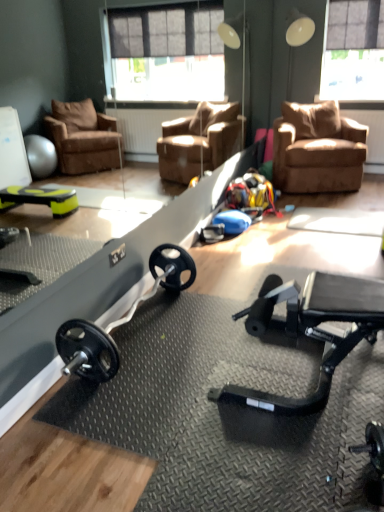
At what (x,y) coordinates should I click in order to perform the action: click on brown suede chair at upper right. Please return your answer as a coordinate pair (x, y). The height and width of the screenshot is (512, 384). Looking at the image, I should click on (317, 149).

This screenshot has height=512, width=384. What do you see at coordinates (353, 51) in the screenshot? I see `translucent plastic window screen at upper right` at bounding box center [353, 51].

The width and height of the screenshot is (384, 512). Identify the location of black rubber barbell at center. (117, 322).

In the image, is black rubber barbell at center positioned in front of or behind brown suede chair at upper right?

In the image, black rubber barbell at center appears in front of brown suede chair at upper right.

Considering the positions of points (107, 362) and (306, 173), is point (107, 362) farther from camera compared to point (306, 173)?

No, it is not.

Considering the sizes of objects black rubber barbell at center and brown suede chair at upper right in the image provided, who is shorter, black rubber barbell at center or brown suede chair at upper right?

black rubber barbell at center.

Is there a large distance between black rubber barbell at center and brown suede chair at upper right?

Indeed, black rubber barbell at center is not near brown suede chair at upper right.

Does brown suede chair at upper right have a lesser width compared to translucent plastic window screen at upper right?

In fact, brown suede chair at upper right might be wider than translucent plastic window screen at upper right.

Is brown suede chair at upper right taller than translucent plastic window screen at upper right?

In fact, brown suede chair at upper right may be shorter than translucent plastic window screen at upper right.

Measure the distance from brown suede chair at upper right to translucent plastic window screen at upper right.

brown suede chair at upper right and translucent plastic window screen at upper right are 1.30 meters apart from each other.

Is brown suede chair at upper right behind black rubber barbell at center?

Yes, brown suede chair at upper right is behind black rubber barbell at center.

Measure the distance between brown suede chair at upper right and black rubber barbell at center.

brown suede chair at upper right and black rubber barbell at center are 8.42 feet apart from each other.

Image resolution: width=384 pixels, height=512 pixels. Find the location of `chair that appears above the black rubber barbell at center (from the image's perspective)`. chair that appears above the black rubber barbell at center (from the image's perspective) is located at coordinates (317, 149).

Can you confirm if brown suede chair at upper right is shorter than black rubber barbell at center?

Incorrect, the height of brown suede chair at upper right does not fall short of that of black rubber barbell at center.

This screenshot has height=512, width=384. Identify the location of window screen that appears behind the brown suede chair at upper right. (353, 51).

How different are the orientations of translucent plastic window screen at upper right and brown suede chair at upper right in degrees?

The facing directions of translucent plastic window screen at upper right and brown suede chair at upper right are 22.1 degrees apart.

Based on the photo, in terms of height, does translucent plastic window screen at upper right look taller or shorter compared to brown suede chair at upper right?

translucent plastic window screen at upper right is taller than brown suede chair at upper right.

From a real-world perspective, is translucent plastic window screen at upper right below brown suede chair at upper right?

No.

Identify the location of barbell in front of the translucent plastic window screen at upper right. The width and height of the screenshot is (384, 512). (117, 322).

Would you say translucent plastic window screen at upper right is part of black rubber barbell at center's contents?

No, translucent plastic window screen at upper right is not inside black rubber barbell at center.

Is black rubber barbell at center bigger or smaller than translucent plastic window screen at upper right?

In the image, black rubber barbell at center appears to be larger than translucent plastic window screen at upper right.

Which is more to the right, translucent plastic window screen at upper right or black rubber barbell at center?

Positioned to the right is translucent plastic window screen at upper right.

Who is bigger, translucent plastic window screen at upper right or black rubber barbell at center?

Bigger between the two is black rubber barbell at center.

Is translucent plastic window screen at upper right spatially inside black rubber barbell at center, or outside of it?

translucent plastic window screen at upper right is located beyond the bounds of black rubber barbell at center.

At what (x,y) coordinates should I click in order to perform the action: click on chair that is on the right side of black rubber barbell at center. Please return your answer as a coordinate pair (x, y). Looking at the image, I should click on (317, 149).

In the image, there is a brown suede chair at upper right. Where is `window screen above it (from the image's perspective)`? window screen above it (from the image's perspective) is located at coordinates (353, 51).

Based on their spatial positions, is black rubber barbell at center or brown suede chair at upper right closer to translucent plastic window screen at upper right?

Among the two, brown suede chair at upper right is located nearer to translucent plastic window screen at upper right.

Based on their spatial positions, is brown suede chair at upper right or translucent plastic window screen at upper right further from black rubber barbell at center?

Among the two, translucent plastic window screen at upper right is located further to black rubber barbell at center.

In the scene shown: Estimate the real-world distances between objects in this image. Which object is closer to brown suede chair at upper right, black rubber barbell at center or translucent plastic window screen at upper right?

The object closer to brown suede chair at upper right is translucent plastic window screen at upper right.

Which object lies further to the anchor point black rubber barbell at center, translucent plastic window screen at upper right or brown suede chair at upper right?

translucent plastic window screen at upper right lies further to black rubber barbell at center than the other object.

When comparing their distances from brown suede chair at upper right, does translucent plastic window screen at upper right or black rubber barbell at center seem closer?

translucent plastic window screen at upper right.

Estimate the real-world distances between objects in this image. Which object is further from translucent plastic window screen at upper right, brown suede chair at upper right or black rubber barbell at center?

black rubber barbell at center is positioned further to the anchor translucent plastic window screen at upper right.

Identify the location of chair between black rubber barbell at center and translucent plastic window screen at upper right along the z-axis. (317, 149).